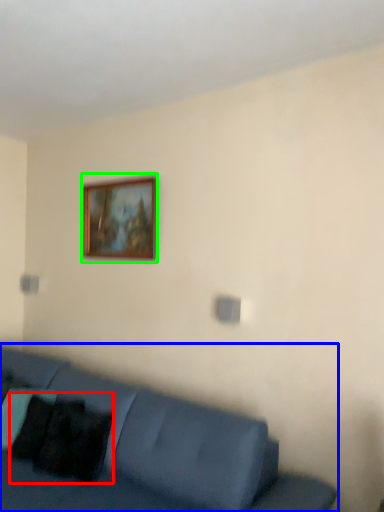
Question: Based on their relative distances, which object is nearer to pillow (highlighted by a red box)? Choose from studio couch (highlighted by a blue box) and picture frame (highlighted by a green box).

Choices:
 (A) studio couch
 (B) picture frame

Answer: (A)